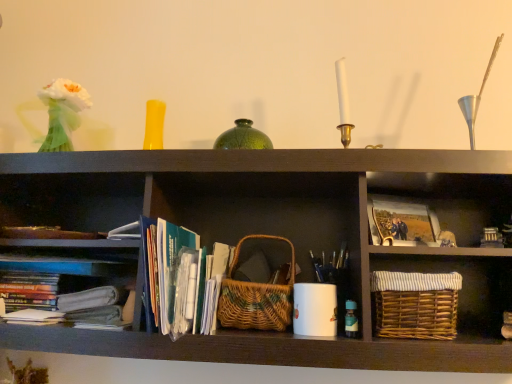
Question: Does woven natural basket at center, which ranks as the 2th basket in right-to-left order, touch translucent glass bottle at lower right?

Choices:
 (A) no
 (B) yes

Answer: (A)

Question: Considering the relative sizes of woven natural basket at center, the first basket when ordered from left to right, and translucent glass bottle at lower right in the image provided, is woven natural basket at center, the first basket when ordered from left to right, smaller than translucent glass bottle at lower right?

Choices:
 (A) no
 (B) yes

Answer: (A)

Question: From the image's perspective, is woven natural basket at center, which ranks as the 2th basket in right-to-left order, located above translucent glass bottle at lower right?

Choices:
 (A) yes
 (B) no

Answer: (A)

Question: From a real-world perspective, is woven natural basket at center, the first basket when ordered from left to right, physically below translucent glass bottle at lower right?

Choices:
 (A) no
 (B) yes

Answer: (A)

Question: Is woven natural basket at center, which ranks as the 2th basket in right-to-left order, to the left of translucent glass bottle at lower right from the viewer's perspective?

Choices:
 (A) yes
 (B) no

Answer: (A)

Question: In the image, is green paperbacks at center on the left side or the right side of translucent glass bottle at lower right?

Choices:
 (A) left
 (B) right

Answer: (A)

Question: Looking at their shapes, would you say green paperbacks at center is wider or thinner than translucent glass bottle at lower right?

Choices:
 (A) thin
 (B) wide

Answer: (B)

Question: Choose the correct answer: Is green paperbacks at center inside translucent glass bottle at lower right or outside it?

Choices:
 (A) outside
 (B) inside

Answer: (A)

Question: Looking at the image, does green paperbacks at center seem bigger or smaller compared to translucent glass bottle at lower right?

Choices:
 (A) small
 (B) big

Answer: (B)

Question: In the image, is matte paper photo at center right positioned in front of or behind woven natural basket at center, which ranks as the 2th basket in right-to-left order?

Choices:
 (A) behind
 (B) front

Answer: (A)

Question: In terms of size, does matte paper photo at center right appear bigger or smaller than woven natural basket at center, which ranks as the 2th basket in right-to-left order?

Choices:
 (A) small
 (B) big

Answer: (A)

Question: Is matte paper photo at center right inside the boundaries of woven natural basket at center, which ranks as the 2th basket in right-to-left order, or outside?

Choices:
 (A) inside
 (B) outside

Answer: (B)

Question: From a real-world perspective, is matte paper photo at center right above or below woven natural basket at center, which ranks as the 2th basket in right-to-left order?

Choices:
 (A) above
 (B) below

Answer: (A)

Question: In terms of size, does translucent glass bottle at lower right appear bigger or smaller than matte paper photo at center right?

Choices:
 (A) big
 (B) small

Answer: (B)

Question: Is translucent glass bottle at lower right wider or thinner than matte paper photo at center right?

Choices:
 (A) wide
 (B) thin

Answer: (A)